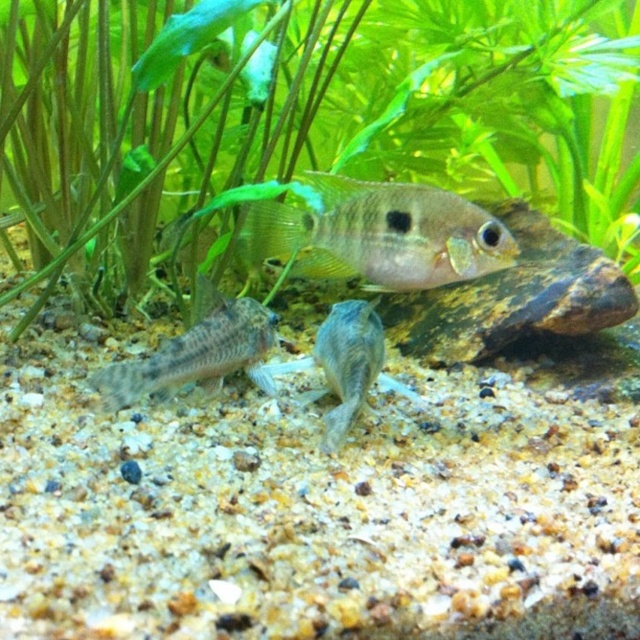
Question: Which of these objects is positioned closest to the shiny silver fish at center?

Choices:
 (A) speckled gray gravel at lower left
 (B) green leafy plant at upper center
 (C) translucent gray fish at center

Answer: (C)

Question: Is green leafy plant at upper center to the left of translucent gray fish at center from the viewer's perspective?

Choices:
 (A) yes
 (B) no

Answer: (B)

Question: Which object is farther from the camera taking this photo?

Choices:
 (A) translucent gray fish at center
 (B) green leafy plant at upper center
 (C) speckled gray gravel at lower left
 (D) shiny silver fish at center

Answer: (A)

Question: Which object is farther from the camera taking this photo?

Choices:
 (A) translucent gray fish at center
 (B) green leafy plant at upper center
 (C) shiny silver fish at center

Answer: (A)

Question: Can you confirm if shiny silver fish at center is positioned to the right of speckled gray gravel at lower left?

Choices:
 (A) no
 (B) yes

Answer: (B)

Question: Is shiny silver fish at center closer to camera compared to speckled gray gravel at lower left?

Choices:
 (A) yes
 (B) no

Answer: (A)